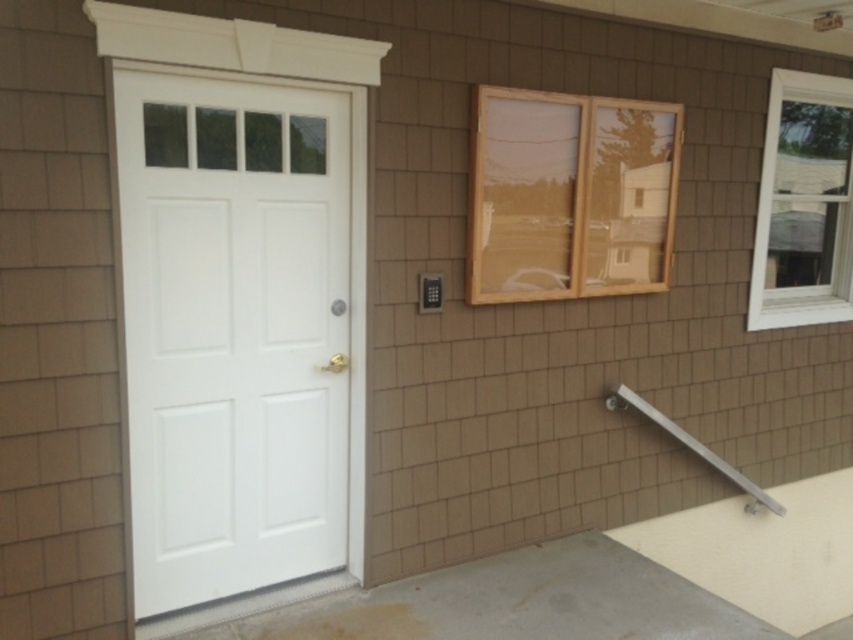
You are standing in front of the building and want to see the notice board through the clear glass window at center. Is the window positioned in a way that allows you to view the notice board?

The clear glass window at center is located at point (569, 195), which is not directly facing the notice board, so you cannot view the notice board through the window.